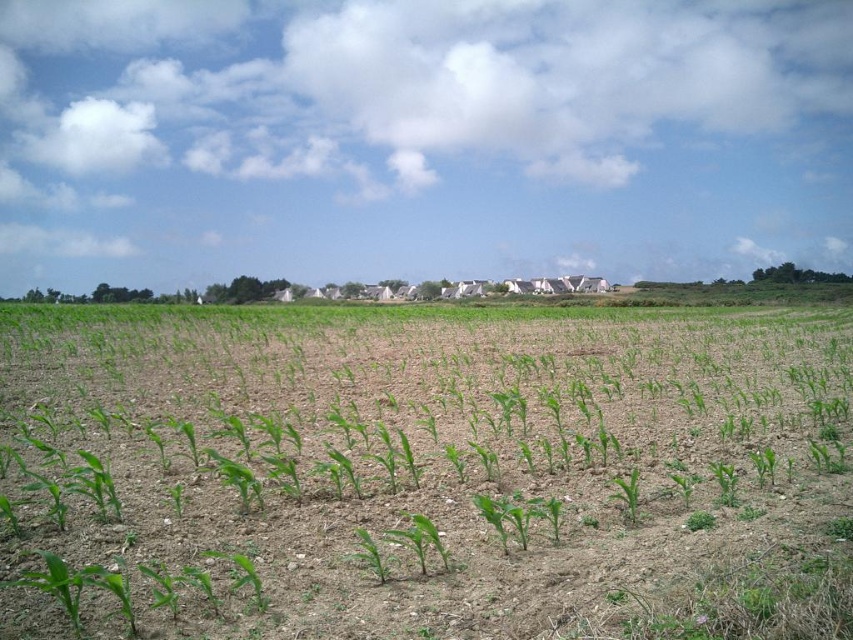
Can you confirm if green leafy corn at center is positioned to the right of green matte plant at center?

No, green leafy corn at center is not to the right of green matte plant at center.

Who is more forward, (x=479, y=337) or (x=622, y=496)?

Point (x=622, y=496) is more forward.

Between point (109, 508) and point (637, 477), which one is positioned behind?

The point (637, 477) is more distant.

I want to click on green leafy corn at center, so click(422, 474).